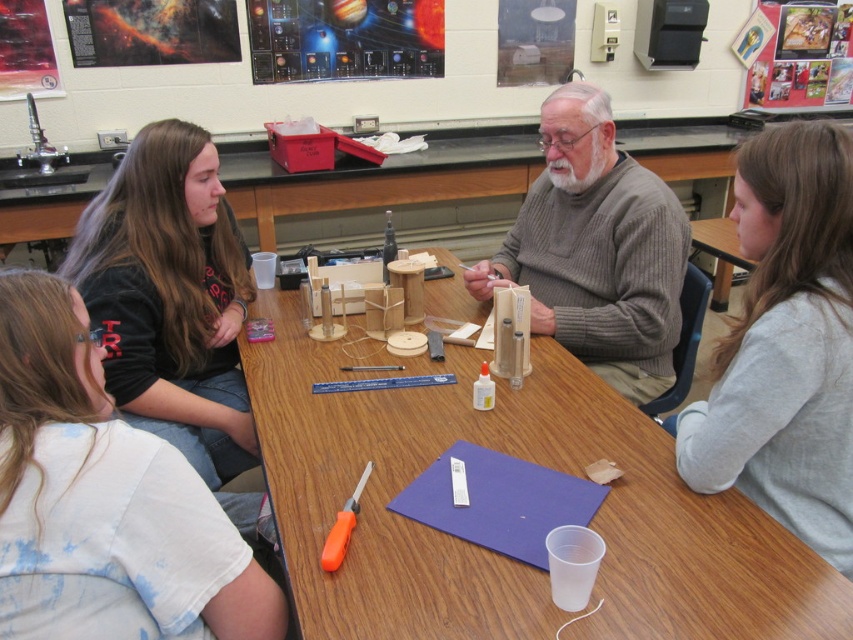
Question: Which object is positioned closest to the orange plastic screwdriver at lower center?

Choices:
 (A) gray cotton shirt at upper right
 (B) wooden at center

Answer: (B)

Question: Does wooden at center appear on the right side of orange plastic screwdriver at lower center?

Choices:
 (A) yes
 (B) no

Answer: (A)

Question: In this image, where is gray ribbed sweater at center located relative to orange plastic screwdriver at lower center?

Choices:
 (A) above
 (B) below

Answer: (A)

Question: Among these objects, which one is farthest from the camera?

Choices:
 (A) gray cotton shirt at upper right
 (B) gray ribbed sweater at center

Answer: (B)

Question: Considering the real-world distances, which object is closest to the gray cotton shirt at upper right?

Choices:
 (A) wooden at center
 (B) orange plastic screwdriver at lower center

Answer: (A)

Question: Can you confirm if wooden at center is thinner than gray cotton shirt at upper right?

Choices:
 (A) no
 (B) yes

Answer: (A)